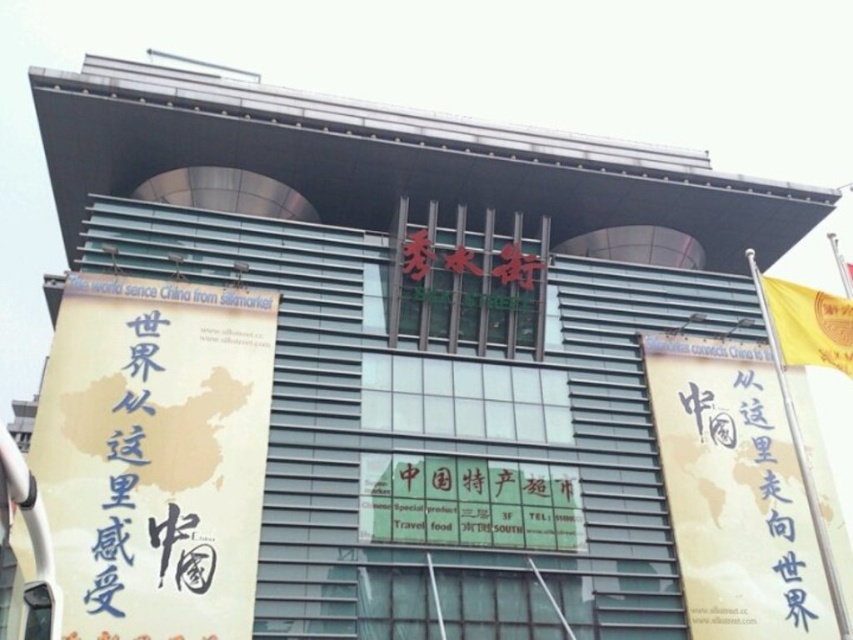
Question: Does yellow paper banner at right appear on the left side of yellow silk flag at upper right?

Choices:
 (A) no
 (B) yes

Answer: (A)

Question: Is yellow paper sign at left further to camera compared to yellow paper banner at right?

Choices:
 (A) no
 (B) yes

Answer: (A)

Question: Can you confirm if yellow paper sign at left is positioned to the right of yellow paper banner at right?

Choices:
 (A) no
 (B) yes

Answer: (A)

Question: Which of the following is the farthest from the observer?

Choices:
 (A) coord(508,483)
 (B) coord(161,456)
 (C) coord(850,360)

Answer: (A)

Question: Among these points, which one is farthest from the camera?

Choices:
 (A) (828, 296)
 (B) (555, 483)
 (C) (728, 596)
 (D) (148, 634)

Answer: (B)

Question: Which of these objects is positioned closest to the yellow paper banner at right?

Choices:
 (A) yellow silk flag at upper right
 (B) green matte signboard at center
 (C) yellow paper sign at left

Answer: (A)